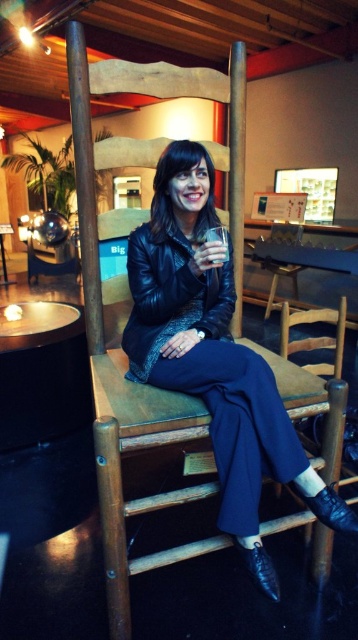
Question: Which object appears closest to the camera in this image?

Choices:
 (A) wooden chair at center
 (B) leather jacket at center

Answer: (B)

Question: Does black leather jacket at center have a lesser width compared to wooden chair at center?

Choices:
 (A) no
 (B) yes

Answer: (B)

Question: Is black leather jacket at center positioned behind wooden chair at center?

Choices:
 (A) yes
 (B) no

Answer: (B)

Question: Does black leather jacket at center have a greater width compared to wooden chair at center?

Choices:
 (A) no
 (B) yes

Answer: (A)

Question: Which of the following is the closest to the observer?

Choices:
 (A) (181, 220)
 (B) (175, 268)
 (C) (283, 227)

Answer: (B)

Question: Among these points, which one is nearest to the camera?

Choices:
 (A) (137, 308)
 (B) (287, 230)
 (C) (244, 508)

Answer: (C)